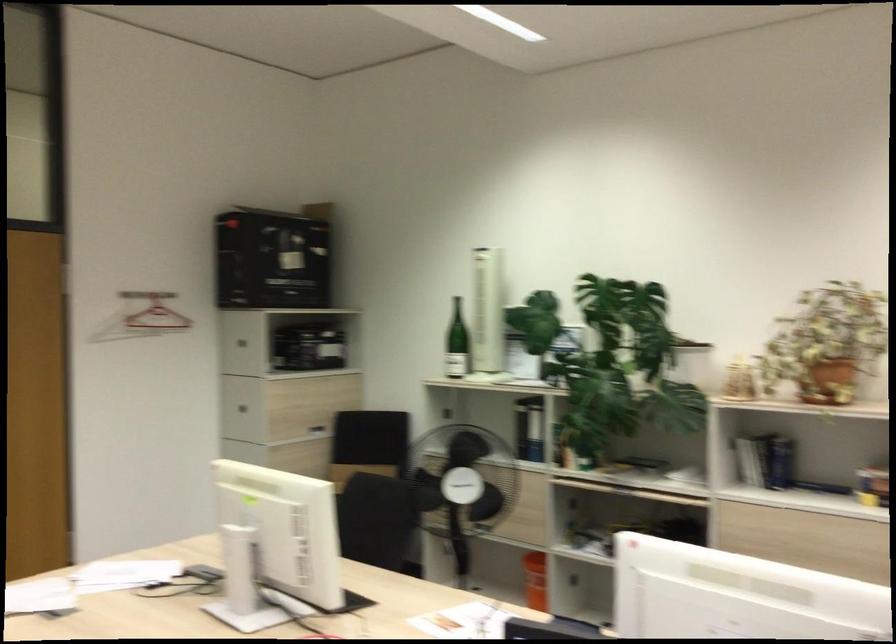
Describe the element at coordinates (142, 317) in the screenshot. This screenshot has width=896, height=644. I see `the red clothes hanger` at that location.